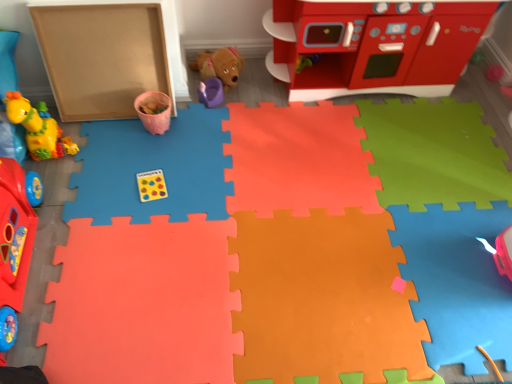
The height and width of the screenshot is (384, 512). I want to click on free space that is to the left of pink matte cup at upper center, marked as the 5th toy in a right-to-left arrangement, so click(112, 130).